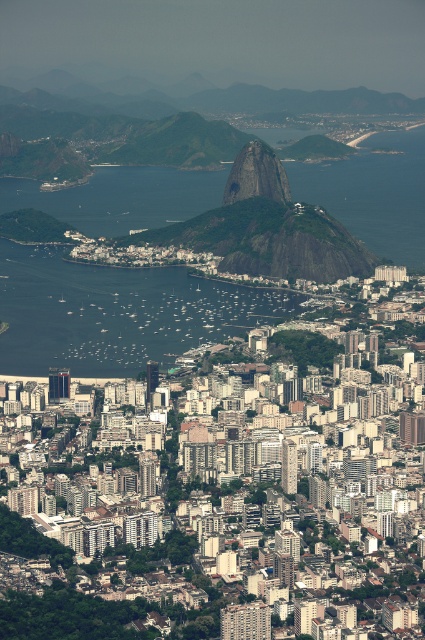
Question: Is clear blue water at center in front of green rock formation at center?

Choices:
 (A) yes
 (B) no

Answer: (A)

Question: Which object appears closest to the camera in this image?

Choices:
 (A) clear blue water at center
 (B) green rock formation at center

Answer: (A)

Question: From the image, what is the correct spatial relationship of clear blue water at center in relation to green rock formation at center?

Choices:
 (A) below
 (B) above

Answer: (A)

Question: Which point appears farthest from the camera in this image?

Choices:
 (A) (45, 352)
 (B) (268, 156)

Answer: (A)

Question: Can you confirm if clear blue water at center is smaller than green rock formation at center?

Choices:
 (A) no
 (B) yes

Answer: (A)